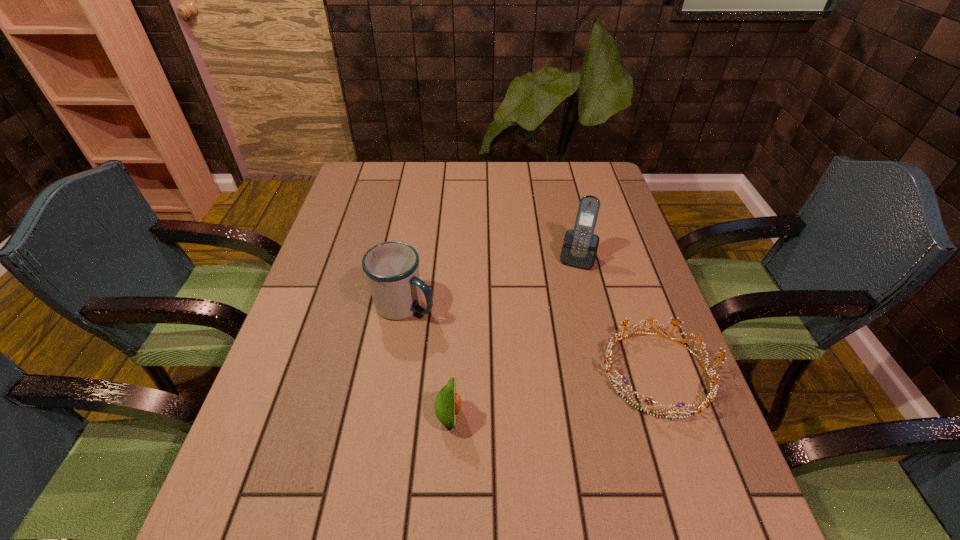
Locate which object ranks second in proximity to the tiara. Please provide its 2D coordinates. Your answer should be formatted as a tuple, i.e. [(x, y)], where the tuple contains the x and y coordinates of a point satisfying the conditions above.

[(447, 404)]

Select which object is the closest to the leftmost object. Please provide its 2D coordinates. Your answer should be formatted as a tuple, i.e. [(x, y)], where the tuple contains the x and y coordinates of a point satisfying the conditions above.

[(447, 404)]

I want to click on free location that satisfies the following two spatial constraints: 1. on the front side of the third shortest object; 2. on the front-facing side of the shortest object, so click(x=394, y=373).

Find the location of a particular element. free space that satisfies the following two spatial constraints: 1. on the front side of the leftmost object; 2. on the front-facing side of the shortest object is located at coordinates (394, 373).

This screenshot has height=540, width=960. Identify the location of vacant space that satisfies the following two spatial constraints: 1. on the front side of the second tallest object; 2. on the cut side of the third object from right to left. tap(386, 417).

Find the location of a particular element. free location that satisfies the following two spatial constraints: 1. on the front side of the leftmost object; 2. on the cut side of the third object from right to left is located at coordinates (386, 417).